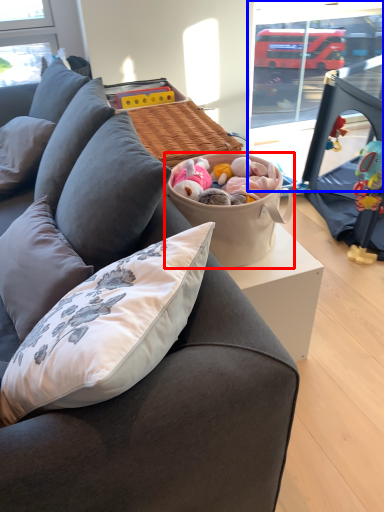
Question: Which point is further to the camera, picnic basket (highlighted by a red box) or window screen (highlighted by a blue box)?

Choices:
 (A) picnic basket
 (B) window screen

Answer: (B)